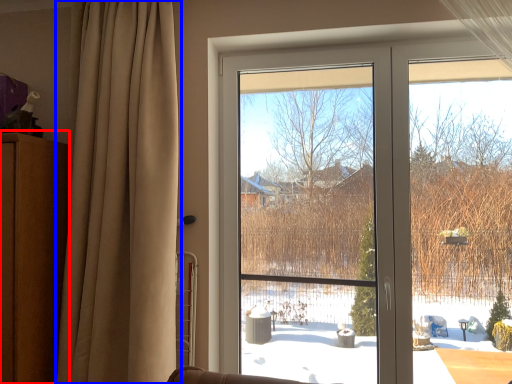
Question: Which object appears closest to the camera in this image, dresser (highlighted by a red box) or curtain (highlighted by a blue box)?

Choices:
 (A) dresser
 (B) curtain

Answer: (B)